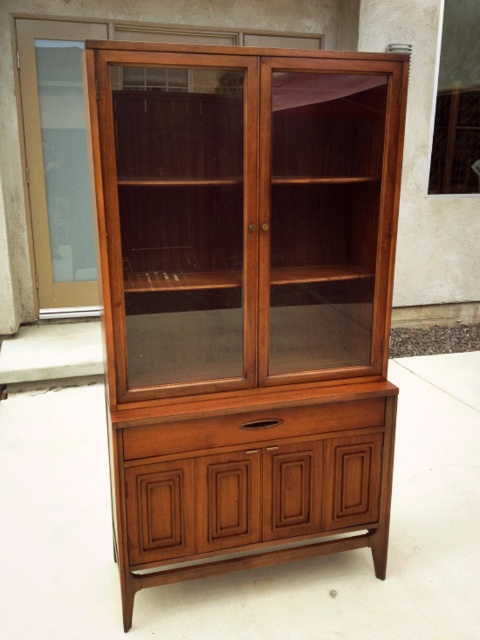
Question: Based on their relative distances, which object is nearer to the frosted glass door at left?

Choices:
 (A) wooden drawer at center
 (B) wooden cabinet at center

Answer: (B)

Question: Is wooden cabinet at center to the left of frosted glass door at left from the viewer's perspective?

Choices:
 (A) yes
 (B) no

Answer: (B)

Question: Where is wooden drawer at center located in relation to frosted glass door at left in the image?

Choices:
 (A) below
 (B) above

Answer: (A)

Question: Does wooden drawer at center lie behind frosted glass door at left?

Choices:
 (A) no
 (B) yes

Answer: (A)

Question: Which object appears closest to the camera in this image?

Choices:
 (A) wooden cabinet at center
 (B) wooden drawer at center

Answer: (A)

Question: Which point is farther from the camera taking this photo?

Choices:
 (A) (57, 170)
 (B) (207, 138)

Answer: (A)